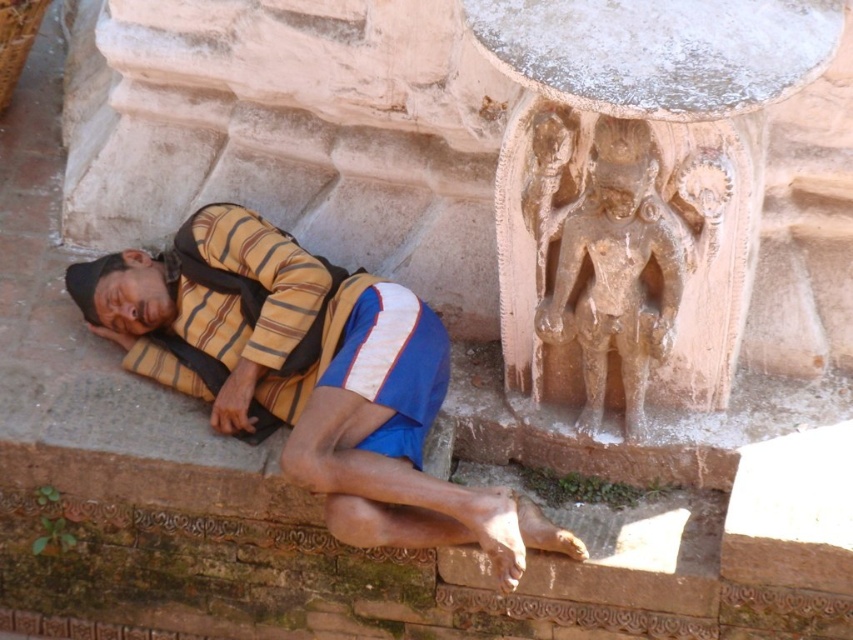
Question: Is carved stone figure at upper center wider than brown stone carving at upper right?

Choices:
 (A) yes
 (B) no

Answer: (A)

Question: Among these objects, which one is farthest from the camera?

Choices:
 (A) carved stone figure at upper center
 (B) brown stone carving at upper right
 (C) yellow striped shirt at left

Answer: (C)

Question: Based on their relative distances, which object is farther from the carved stone figure at upper center?

Choices:
 (A) yellow striped shirt at left
 (B) brown stone carving at upper right

Answer: (A)

Question: Can you confirm if yellow striped shirt at left is thinner than brown stone carving at upper right?

Choices:
 (A) yes
 (B) no

Answer: (B)

Question: Which point appears farthest from the camera in this image?

Choices:
 (A) (438, 346)
 (B) (657, 394)

Answer: (B)

Question: Can you confirm if carved stone figure at upper center is thinner than yellow striped shirt at left?

Choices:
 (A) no
 (B) yes

Answer: (B)